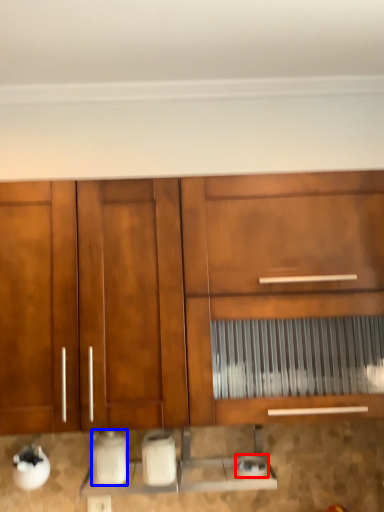
Question: Which of the following is the farthest to the observer, appliance (highlighted by a red box) or appliance (highlighted by a blue box)?

Choices:
 (A) appliance
 (B) appliance

Answer: (A)